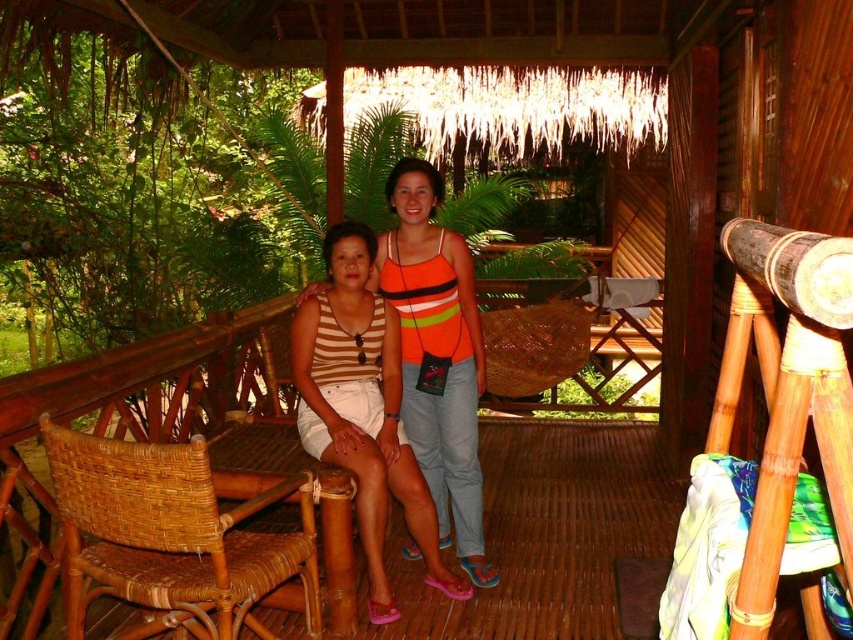
You are standing at the edge of the deck and want to place a small potted plant exactly halfway between the two points marked as point (140,582) and point (415,184). Will the plant be closer to the camera or further away compared to the two points?

The plant placed halfway between point (140,582) and point (415,184) will be closer to the camera than point (415,184) but further away than point (140,582). However, since the question asks whether it is closer or further compared to the two points, the answer depends on the relative distances. Since point (140,582) is closer to the camera than point (415,184), the midpoint will be closer to the camera than the farther point but further than the closer one. Therefore, the plant will be in

You are planning to place a new decorative item on the patio that needs to be larger than the orange striped tank top at center. Can the woven rattan chair at lower left accommodate this requirement?

The woven rattan chair at lower left is smaller than the orange striped tank top at center, so it cannot accommodate a decorative item that needs to be larger than the orange striped tank top at center.

From the picture: You are planning to place a new decorative item on the patio. The item requires a surface area equal to the width of the orange striped tank top at center. Is the woven rattan chair at lower left wide enough to accommodate it?

The woven rattan chair at lower left is wider than the orange striped tank top at center, so yes, it can accommodate the decorative item requiring the width of the orange striped tank top at center.